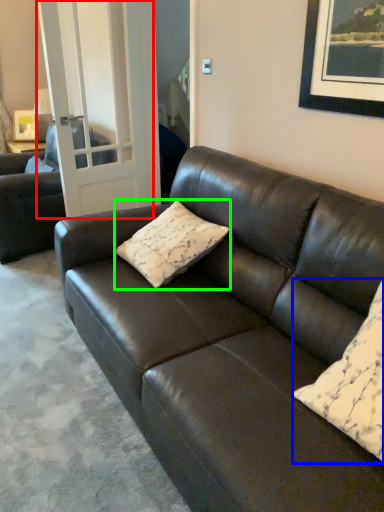
Question: Which object is positioned closest to glass door (highlighted by a red box)? Select from pillow (highlighted by a blue box) and pillow (highlighted by a green box).

Choices:
 (A) pillow
 (B) pillow

Answer: (B)